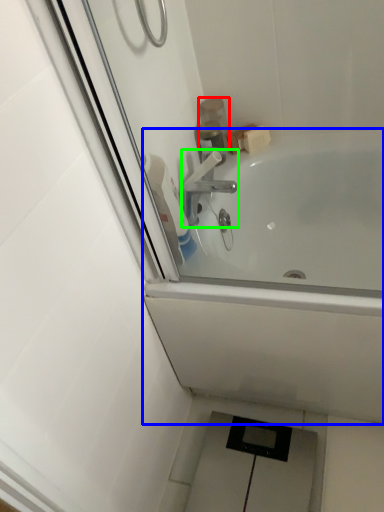
Question: Estimate the real-world distances between objects in this image. Which object is farther from toiletry (highlighted by a red box), bathtub (highlighted by a blue box) or tap (highlighted by a green box)?

Choices:
 (A) bathtub
 (B) tap

Answer: (A)